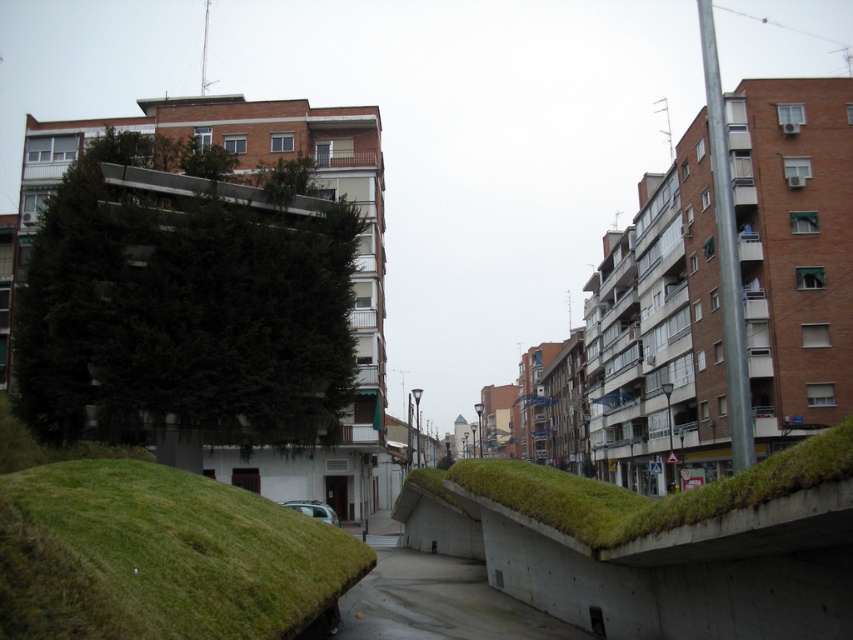
Can you confirm if green grassy mound at center is bigger than silver metallic car at center?

No.

Does point (248, 582) come in front of point (326, 520)?

Yes, it is in front of point (326, 520).

Find the location of `green grassy mound at center`. green grassy mound at center is located at coordinates (158, 556).

Does concrete at center appear on the left side of silver metallic car at center?

In fact, concrete at center is to the right of silver metallic car at center.

Who is positioned more to the left, concrete at center or silver metallic car at center?

silver metallic car at center is more to the left.

I want to click on concrete at center, so click(x=438, y=604).

Locate an element on the screen. The height and width of the screenshot is (640, 853). concrete at center is located at coordinates (438, 604).

Does green grassy mound at center have a smaller size compared to concrete at center?

Yes, green grassy mound at center is smaller than concrete at center.

Does green grassy mound at center lie behind concrete at center?

No.

Is point (277, 582) positioned behind point (461, 628)?

No, it is not.

Where is `green grassy mound at center`? green grassy mound at center is located at coordinates (158, 556).